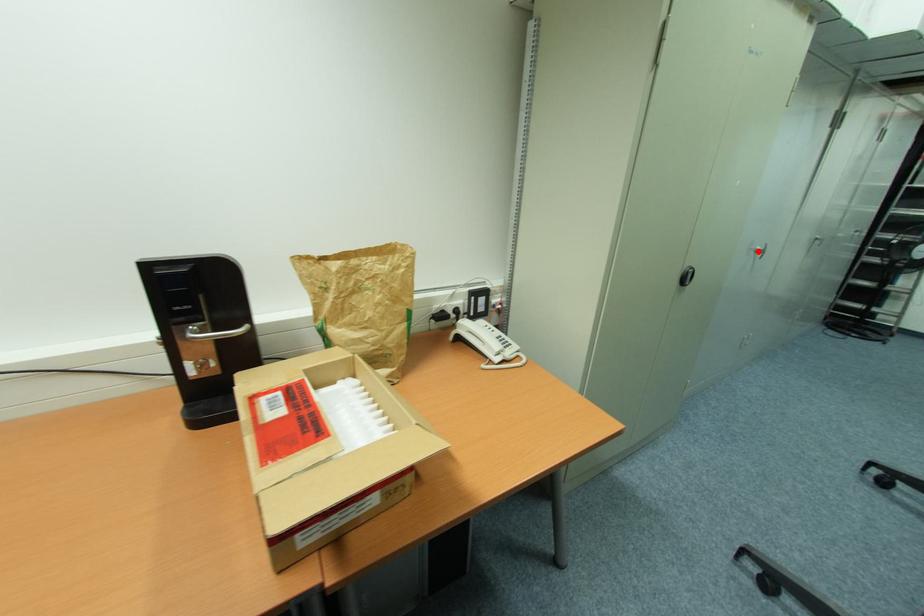
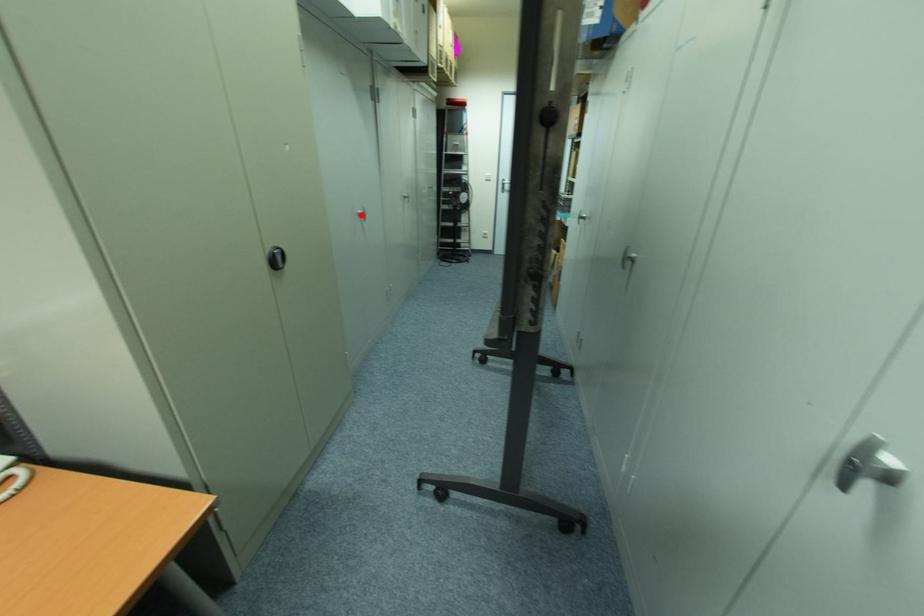
I am providing you with two images of the same scene from different viewpoints. A red point is marked on the first image and another point is marked on the second image. Are the points marked in image1 and image2 representing the same 3D position?

Yes